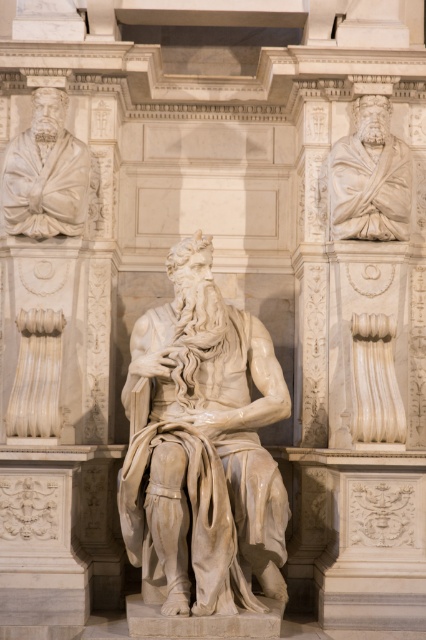
Question: Is white marble statue at center to the right of white marble statue at upper left from the viewer's perspective?

Choices:
 (A) no
 (B) yes

Answer: (B)

Question: Based on their relative distances, which object is farther from the white marble statue at upper left?

Choices:
 (A) white marble statue at center
 (B) white marble bust at upper right

Answer: (B)

Question: Considering the real-world distances, which object is closest to the white marble statue at upper left?

Choices:
 (A) white marble bust at upper right
 (B) white marble statue at center

Answer: (B)

Question: Is white marble statue at center behind white marble statue at upper left?

Choices:
 (A) yes
 (B) no

Answer: (B)

Question: Which object is closer to the camera taking this photo?

Choices:
 (A) white marble statue at upper left
 (B) white marble bust at upper right
 (C) white marble statue at center

Answer: (C)

Question: Considering the relative positions of white marble statue at upper left and white marble bust at upper right in the image provided, where is white marble statue at upper left located with respect to white marble bust at upper right?

Choices:
 (A) below
 (B) above

Answer: (B)